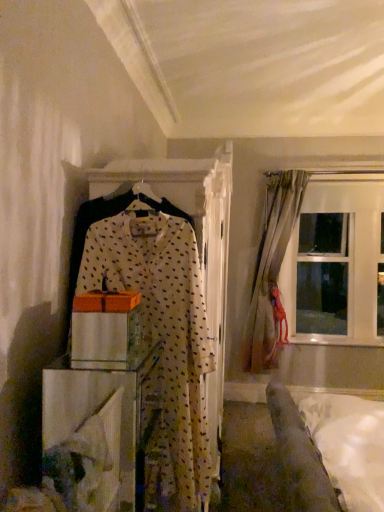
What do you see at coordinates (335, 264) in the screenshot?
I see `transparent glass window at upper right` at bounding box center [335, 264].

The image size is (384, 512). What do you see at coordinates (272, 273) in the screenshot?
I see `light beige fabric curtain at right` at bounding box center [272, 273].

Image resolution: width=384 pixels, height=512 pixels. In order to click on wooden box at center in this screenshot , I will do `click(95, 405)`.

Locate an element on the screen. transparent glass window at upper right is located at coordinates (335, 264).

Is transparent glass window at upper right positioned with its back to white sheer with polka dots at center?

No.

Is transparent glass window at upper right touching white sheer with polka dots at center?

No, transparent glass window at upper right is not making contact with white sheer with polka dots at center.

Considering the positions of points (308, 271) and (191, 318), is point (308, 271) farther from camera compared to point (191, 318)?

Yes, point (308, 271) is behind point (191, 318).

Considering the relative sizes of transparent glass window at upper right and white sheer with polka dots at center in the image provided, is transparent glass window at upper right smaller than white sheer with polka dots at center?

No.

Which object is thinner, wooden box at center or transparent glass window at upper right?

Thinner between the two is transparent glass window at upper right.

Which of these two, wooden box at center or transparent glass window at upper right, is bigger?

With larger size is transparent glass window at upper right.

Identify the location of furniture in front of the transparent glass window at upper right. (95, 405).

In terms of height, does wooden box at center look taller or shorter compared to transparent glass window at upper right?

Considering their sizes, wooden box at center has less height than transparent glass window at upper right.

Is wooden box at center a part of white sheer with polka dots at center?

No, wooden box at center is not a part of white sheer with polka dots at center.

Is white sheer with polka dots at center turned away from wooden box at center?

Yes, white sheer with polka dots at center is positioned with its back facing wooden box at center.

From the image's perspective, is white sheer with polka dots at center positioned above or below wooden box at center?

Based on their image positions, white sheer with polka dots at center is located above wooden box at center.

Is the position of white sheer with polka dots at center less distant than that of wooden box at center?

No, white sheer with polka dots at center is further to the viewer.

From the image's perspective, which is below, wooden box at center or white sheer with polka dots at center?

wooden box at center appears lower in the image.

In terms of height, does wooden box at center look taller or shorter compared to white sheer with polka dots at center?

In the image, wooden box at center appears to be shorter than white sheer with polka dots at center.

Considering the positions of point (131, 401) and point (207, 343), is point (131, 401) closer or farther from the camera than point (207, 343)?

Point (131, 401).

Is wooden box at center oriented towards white sheer with polka dots at center?

No, wooden box at center does not turn towards white sheer with polka dots at center.

From a real-world perspective, is white soft bed at lower right positioned over light beige fabric curtain at right based on gravity?

Actually, white soft bed at lower right is physically below light beige fabric curtain at right in the real world.

Is white soft bed at lower right thinner than light beige fabric curtain at right?

Incorrect, the width of white soft bed at lower right is not less than that of light beige fabric curtain at right.

In the scene shown: Are white soft bed at lower right and light beige fabric curtain at right beside each other?

white soft bed at lower right is not next to light beige fabric curtain at right, and they're not touching.

Considering the relative positions of white soft bed at lower right and light beige fabric curtain at right in the image provided, is white soft bed at lower right in front of light beige fabric curtain at right?

Yes, it is in front of light beige fabric curtain at right.

Considering the relative positions of light beige fabric curtain at right and white soft bed at lower right in the image provided, is light beige fabric curtain at right to the left or to the right of white soft bed at lower right?

Based on their positions, light beige fabric curtain at right is located to the left of white soft bed at lower right.

Is point (266, 214) closer or farther from the camera than point (323, 466)?

Clearly, point (266, 214) is more distant from the camera than point (323, 466).

Would you say light beige fabric curtain at right is inside or outside white soft bed at lower right?

The correct answer is: outside.

From the image's perspective, is light beige fabric curtain at right beneath white soft bed at lower right?

No, from the image's perspective, light beige fabric curtain at right is not below white soft bed at lower right.

From the image's perspective, which is above, light beige fabric curtain at right or transparent glass window at upper right?

From the image's view, transparent glass window at upper right is above.

Is light beige fabric curtain at right aimed at transparent glass window at upper right?

No, light beige fabric curtain at right does not turn towards transparent glass window at upper right.

Is light beige fabric curtain at right to the right of transparent glass window at upper right from the viewer's perspective?

Incorrect, light beige fabric curtain at right is not on the right side of transparent glass window at upper right.

How much distance is there between light beige fabric curtain at right and transparent glass window at upper right?

A distance of 19.06 inches exists between light beige fabric curtain at right and transparent glass window at upper right.

Find the location of a particular element. Image resolution: width=384 pixels, height=512 pixels. fancy dress that appears below the transparent glass window at upper right (from a real-world perspective) is located at coordinates (162, 341).

Locate an element on the screen. This screenshot has height=512, width=384. furniture in front of the transparent glass window at upper right is located at coordinates (95, 405).

Considering their positions, is white soft bed at lower right positioned further to transparent glass window at upper right than white sheer with polka dots at center?

white sheer with polka dots at center is positioned further to the anchor transparent glass window at upper right.

Which object lies nearer to the anchor point white sheer with polka dots at center, white soft bed at lower right or light beige fabric curtain at right?

Among the two, white soft bed at lower right is located nearer to white sheer with polka dots at center.

Based on their spatial positions, is transparent glass window at upper right or wooden box at center closer to light beige fabric curtain at right?

transparent glass window at upper right.

From the image, which object appears to be nearer to white sheer with polka dots at center, light beige fabric curtain at right or wooden box at center?

Among the two, wooden box at center is located nearer to white sheer with polka dots at center.

Based on the photo, looking at the image, which one is located closer to light beige fabric curtain at right, white soft bed at lower right or white sheer with polka dots at center?

The object closer to light beige fabric curtain at right is white soft bed at lower right.

When comparing their distances from transparent glass window at upper right, does white soft bed at lower right or light beige fabric curtain at right seem further?

Among the two, white soft bed at lower right is located further to transparent glass window at upper right.

Considering their positions, is wooden box at center positioned closer to transparent glass window at upper right than white soft bed at lower right?

white soft bed at lower right lies closer to transparent glass window at upper right than the other object.

Based on their spatial positions, is transparent glass window at upper right or white soft bed at lower right closer to wooden box at center?

white soft bed at lower right lies closer to wooden box at center than the other object.

Identify the location of fancy dress positioned between white soft bed at lower right and transparent glass window at upper right from near to far. (162, 341).

This screenshot has width=384, height=512. Identify the location of fancy dress positioned between white soft bed at lower right and light beige fabric curtain at right from near to far. (162, 341).

At what (x,y) coordinates should I click in order to perform the action: click on curtain located between wooden box at center and transparent glass window at upper right in the depth direction. Please return your answer as a coordinate pair (x, y). The width and height of the screenshot is (384, 512). Looking at the image, I should click on (272, 273).

The height and width of the screenshot is (512, 384). I want to click on curtain between white sheer with polka dots at center and transparent glass window at upper right in the front-back direction, so click(272, 273).